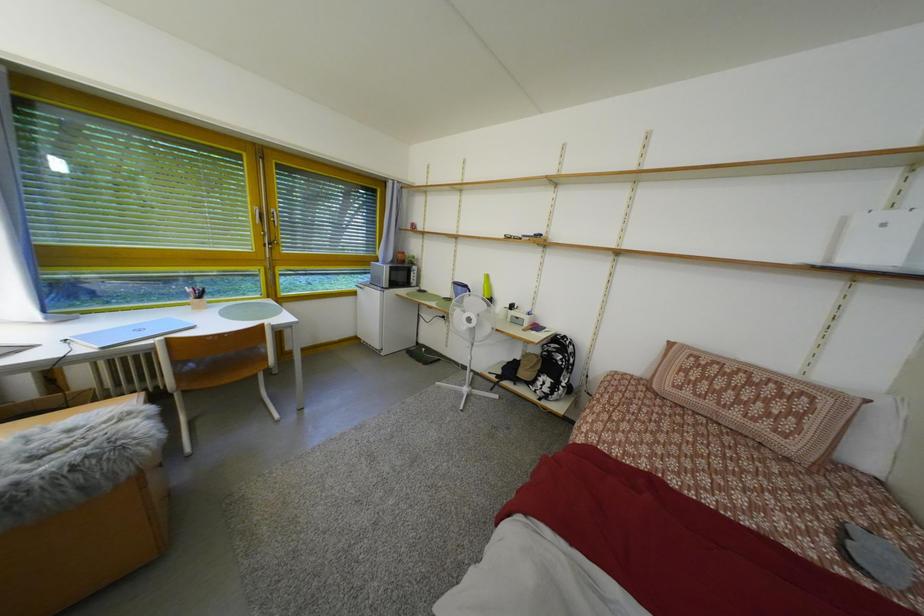
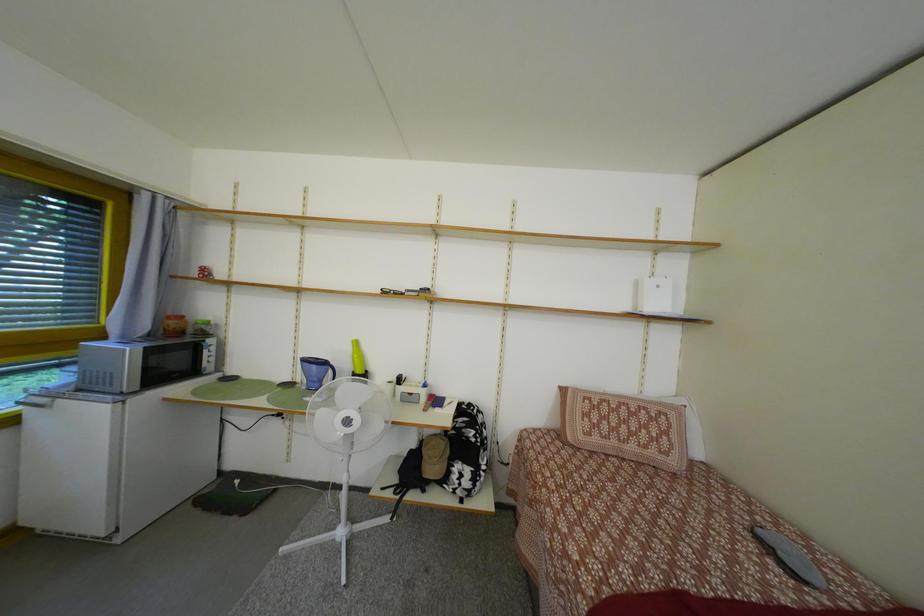
Question: The first image is from the beginning of the video and the second image is from the end. How did the camera likely rotate when shooting the video?

Choices:
 (A) Left
 (B) Right
 (C) Up
 (D) Down

Answer: (B)